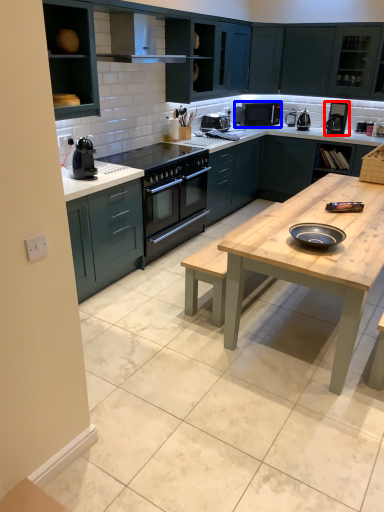
Question: Which object appears farthest to the camera in this image, coffee machine (highlighted by a red box) or microwave oven (highlighted by a blue box)?

Choices:
 (A) coffee machine
 (B) microwave oven

Answer: (B)